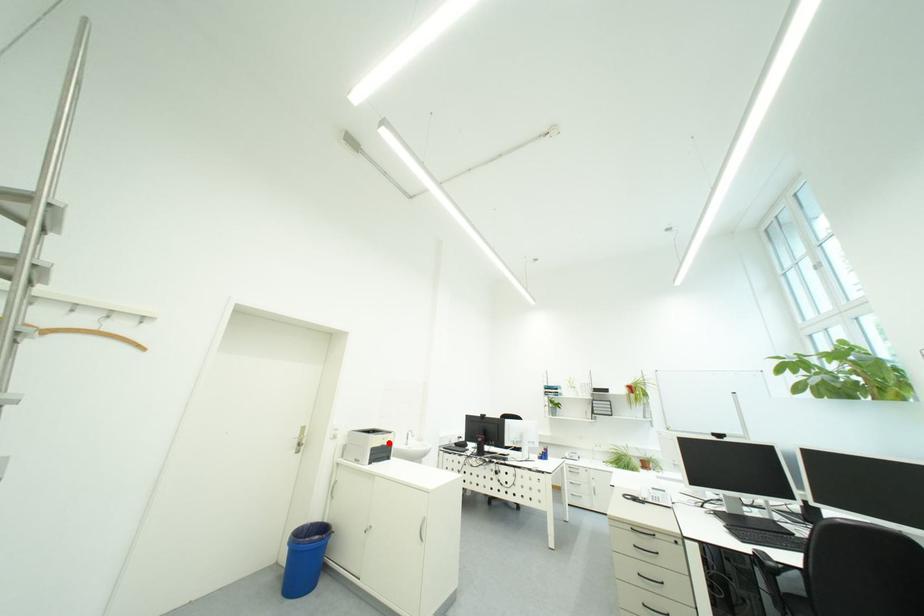
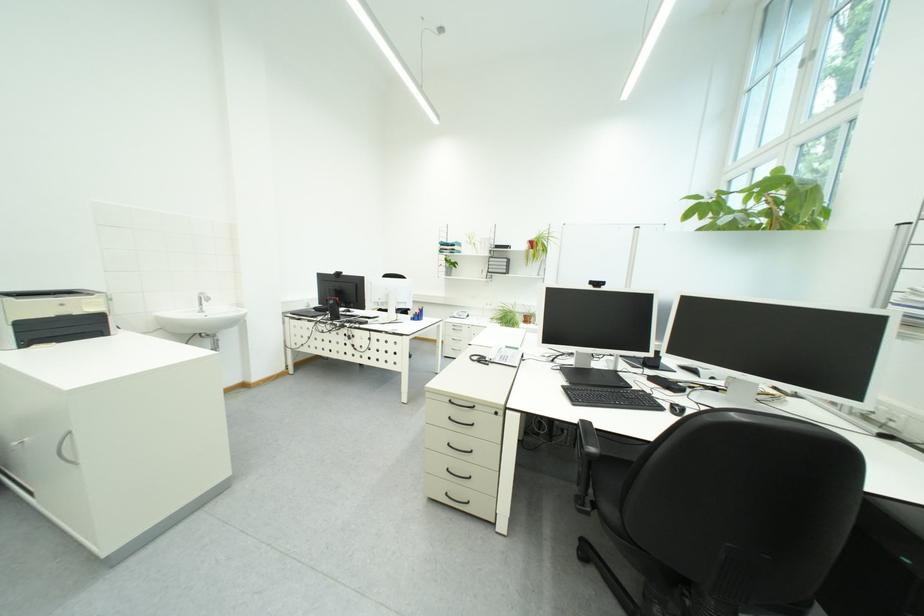
The point at the highlighted location is marked in the first image. Where is the corresponding point in the second image?

(55, 310)